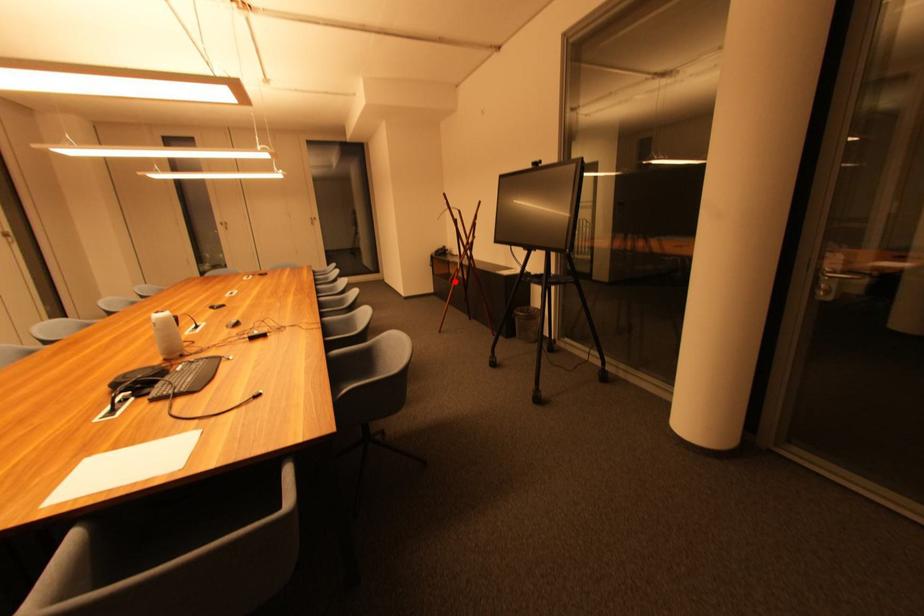
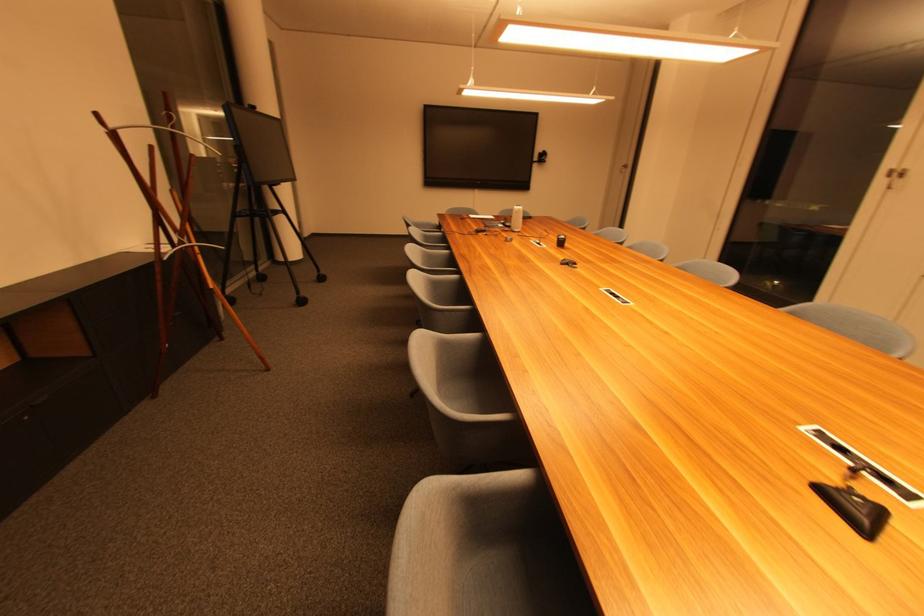
Question: A red point is marked in image1. In image2, is the corresponding 3D point closer to the camera or farther? Reply with the corresponding letter.

Choices:
 (A) The corresponding 3D point is closer.
 (B) The corresponding 3D point is farther.

Answer: (A)